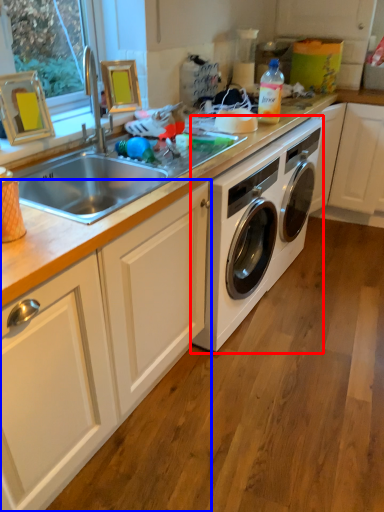
Question: Which object is closer to the camera taking this photo, washing machine (highlighted by a red box) or cabinetry (highlighted by a blue box)?

Choices:
 (A) washing machine
 (B) cabinetry

Answer: (B)